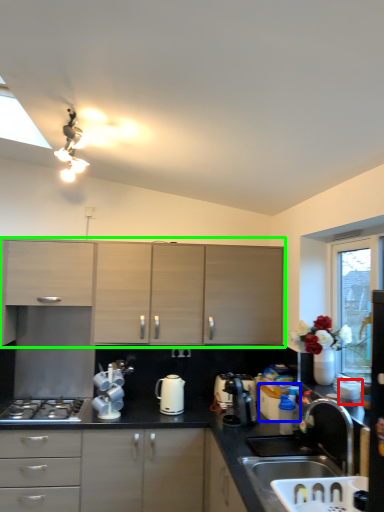
Question: Estimate the real-world distances between objects in this image. Which object is closer to appliance (highlighted by a red box), appliance (highlighted by a blue box) or cabinetry (highlighted by a green box)?

Choices:
 (A) appliance
 (B) cabinetry

Answer: (A)